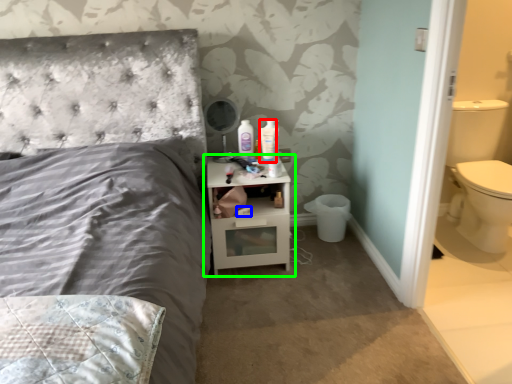
Question: Considering the real-world distances, which object is closest to mouthwash (highlighted by a red box)? toilet paper (highlighted by a blue box) or nightstand (highlighted by a green box).

Choices:
 (A) toilet paper
 (B) nightstand

Answer: (B)